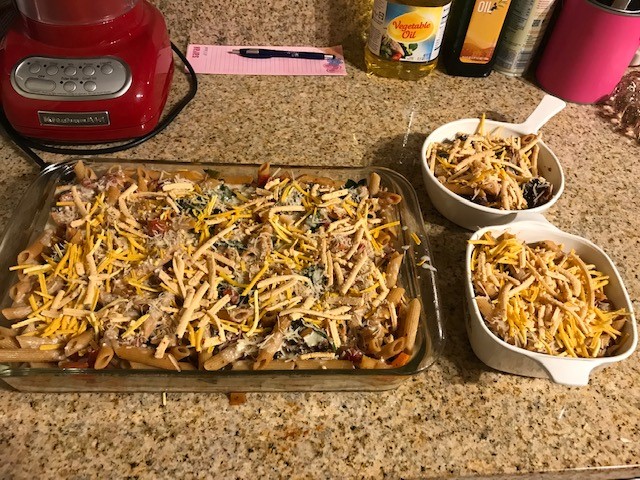
At what (x,y) coordinates should I click in order to perform the action: click on blender. Please return your answer as a coordinate pair (x, y). Looking at the image, I should click on (123, 42).